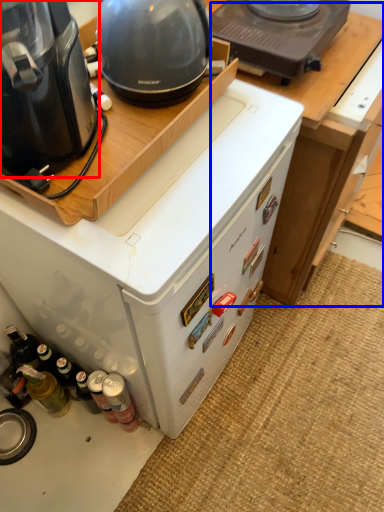
Question: Which of the following is the farthest to the observer, home appliance (highlighted by a red box) or table (highlighted by a blue box)?

Choices:
 (A) home appliance
 (B) table

Answer: (B)